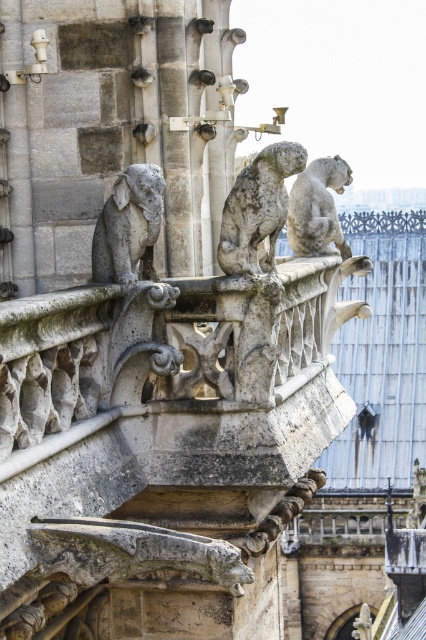
Is stone gargoyle at center smaller than gray stone gargoyle at upper right?

Indeed, stone gargoyle at center has a smaller size compared to gray stone gargoyle at upper right.

Consider the image. Is stone gargoyle at center to the right of gray stone gargoyle at upper right from the viewer's perspective?

In fact, stone gargoyle at center is to the left of gray stone gargoyle at upper right.

Who is more forward, (258, 188) or (290, 202)?

Positioned in front is point (258, 188).

Where is `stone gargoyle at center`? Image resolution: width=426 pixels, height=640 pixels. stone gargoyle at center is located at coordinates (258, 209).

Looking at this image, which of these two, gray stone gargoyle at center or gray stone gargoyle at upper right, stands taller?

gray stone gargoyle at upper right

Image resolution: width=426 pixels, height=640 pixels. Describe the element at coordinates (134, 278) in the screenshot. I see `gray stone gargoyle at center` at that location.

Identify the location of gray stone gargoyle at center. The image size is (426, 640). (134, 278).

Does gray stone gargoyle at center come behind stone gargoyle at center?

No, gray stone gargoyle at center is closer to the viewer.

Is gray stone gargoyle at center to the right of stone gargoyle at center from the viewer's perspective?

Incorrect, gray stone gargoyle at center is not on the right side of stone gargoyle at center.

At what (x,y) coordinates should I click in order to perform the action: click on gray stone gargoyle at center. Please return your answer as a coordinate pair (x, y). Looking at the image, I should click on (134, 278).